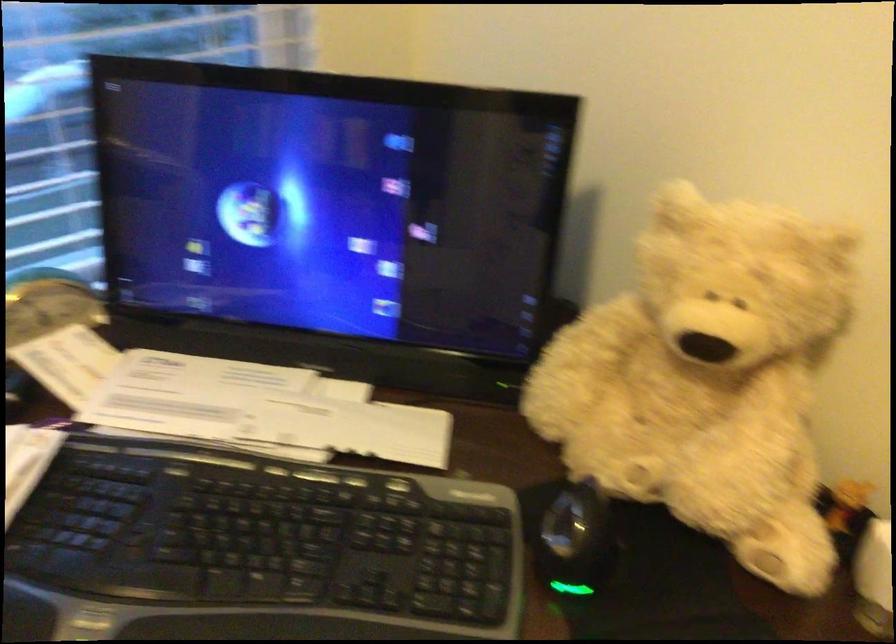
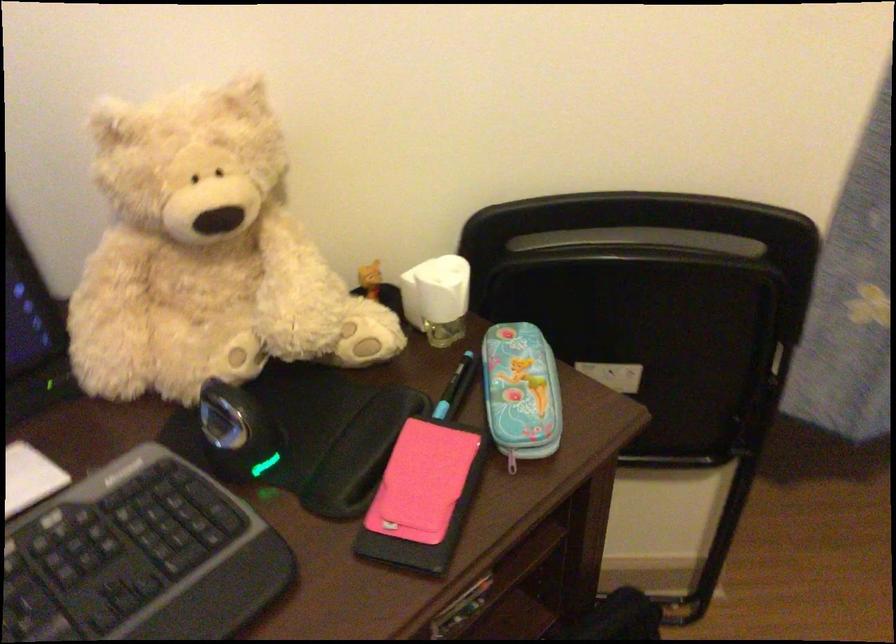
Find the pixel in the second image that matches point 679,361 in the first image.

(205, 254)